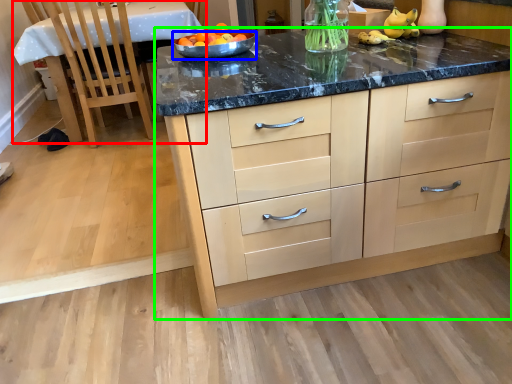
Question: Which object is positioned farthest from table (highlighted by a red box)? Select from bowl (highlighted by a blue box) and cabinetry (highlighted by a green box).

Choices:
 (A) bowl
 (B) cabinetry

Answer: (B)